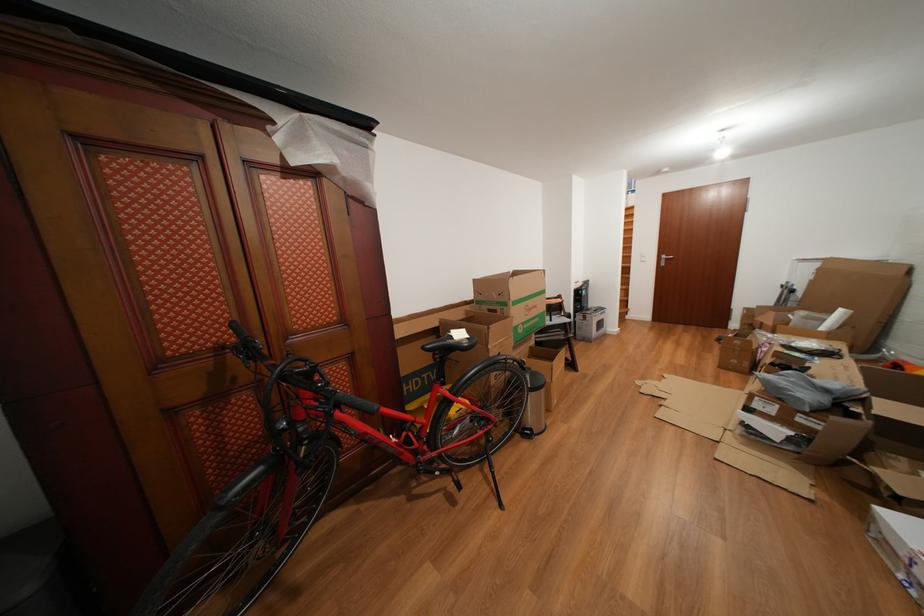
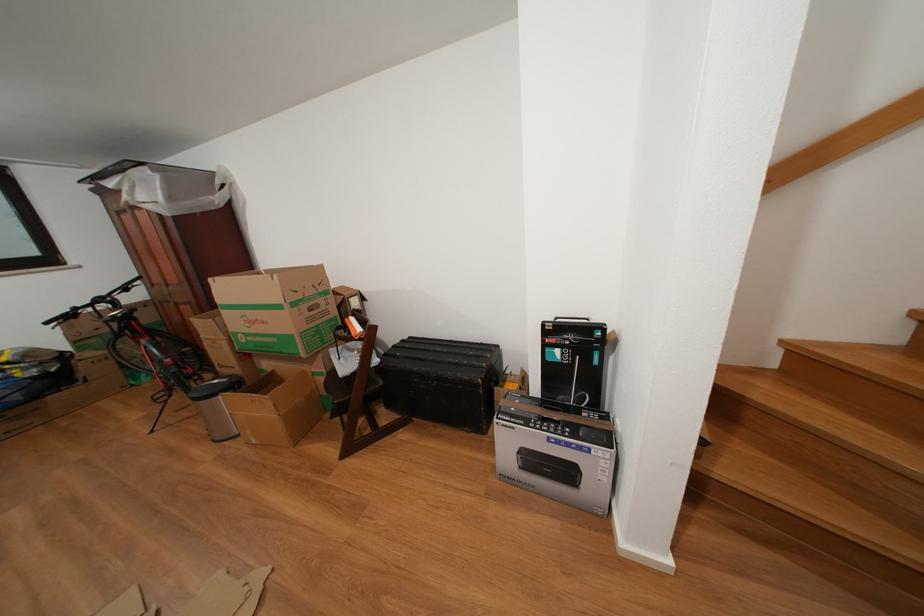
The point at (468,339) is marked in the first image. Where is the corresponding point in the second image?

(126, 317)